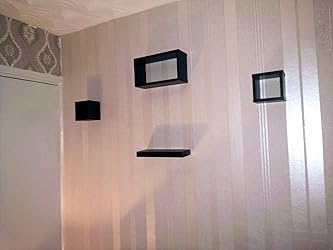
Please find where you'd put something on shelf in the image and show me where they are. Your answer should be formatted as a list of tuples, i.e. [(x1, y1), (x2, y2), ...], where each tuple contains the x and y coordinates of a point satisfying the conditions above.

[(167, 151)]